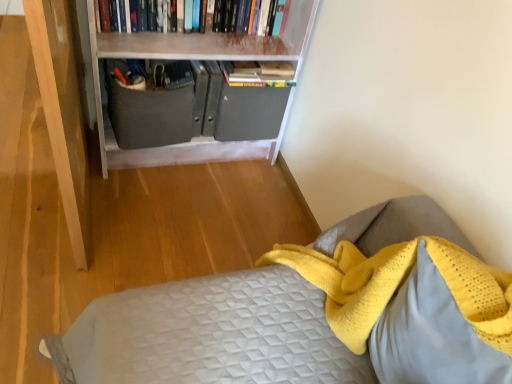
The width and height of the screenshot is (512, 384). I want to click on blank space situated above yellow knitted pillow at lower right (from a real-world perspective), so click(471, 300).